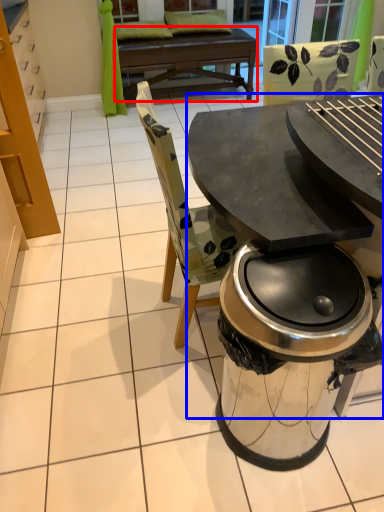
Question: Which object is further to the camera taking this photo, round table (highlighted by a red box) or table (highlighted by a blue box)?

Choices:
 (A) round table
 (B) table

Answer: (A)